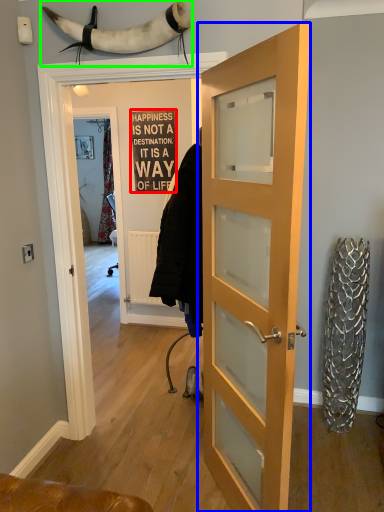
Question: Which object is the closest to the writing (highlighted by a red box)? Choose among these: door (highlighted by a blue box) or animal (highlighted by a green box).

Choices:
 (A) door
 (B) animal

Answer: (A)